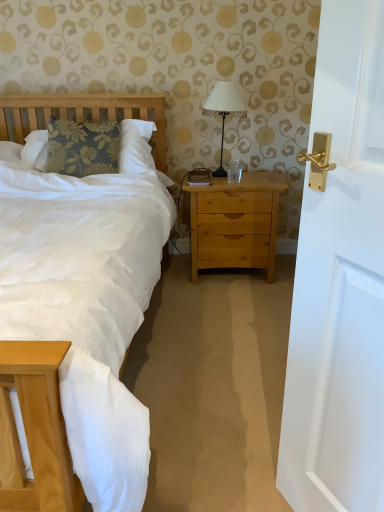
Question: From the image's perspective, is white fabric-covered lamp at upper center located beneath light brown wood nightstand at center?

Choices:
 (A) no
 (B) yes

Answer: (A)

Question: Does white fabric-covered lamp at upper center appear on the right side of light brown wood nightstand at center?

Choices:
 (A) yes
 (B) no

Answer: (B)

Question: Does white fabric-covered lamp at upper center have a smaller size compared to light brown wood nightstand at center?

Choices:
 (A) yes
 (B) no

Answer: (A)

Question: Could you tell me if white fabric-covered lamp at upper center is turned towards light brown wood nightstand at center?

Choices:
 (A) yes
 (B) no

Answer: (B)

Question: Is white fabric-covered lamp at upper center shorter than light brown wood nightstand at center?

Choices:
 (A) yes
 (B) no

Answer: (A)

Question: Considering the relative sizes of white fabric-covered lamp at upper center and light brown wood nightstand at center in the image provided, is white fabric-covered lamp at upper center wider than light brown wood nightstand at center?

Choices:
 (A) no
 (B) yes

Answer: (A)

Question: Is light brown wood nightstand at center with white fabric-covered lamp at upper center?

Choices:
 (A) no
 (B) yes

Answer: (A)

Question: Can you confirm if light brown wood nightstand at center is positioned to the left of white fabric-covered lamp at upper center?

Choices:
 (A) yes
 (B) no

Answer: (B)

Question: Is light brown wood nightstand at center turned away from white fabric-covered lamp at upper center?

Choices:
 (A) no
 (B) yes

Answer: (A)

Question: From a real-world perspective, is light brown wood nightstand at center under white fabric-covered lamp at upper center?

Choices:
 (A) no
 (B) yes

Answer: (B)

Question: Is the position of light brown wood nightstand at center more distant than that of white fabric-covered lamp at upper center?

Choices:
 (A) no
 (B) yes

Answer: (B)

Question: From the image's perspective, is light brown wood nightstand at center over white fabric-covered lamp at upper center?

Choices:
 (A) yes
 (B) no

Answer: (B)

Question: Based on their positions, is light brown wood nightstand at center located to the left or right of white fabric-covered lamp at upper center?

Choices:
 (A) left
 (B) right

Answer: (B)